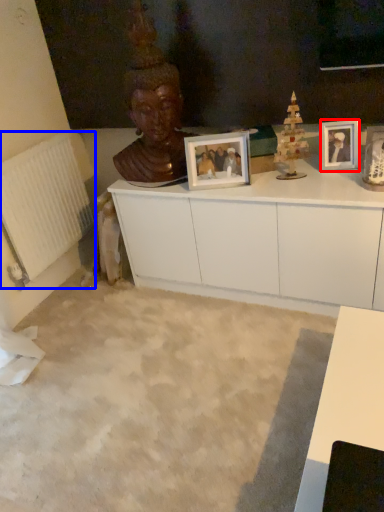
Question: Among these objects, which one is nearest to the camera, picture frame (highlighted by a red box) or radiator (highlighted by a blue box)?

Choices:
 (A) picture frame
 (B) radiator

Answer: (A)